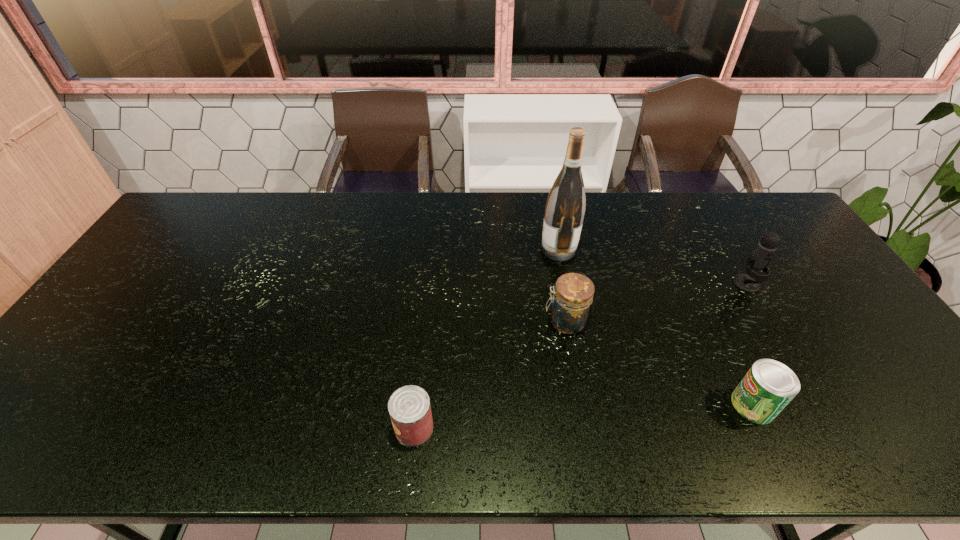
This screenshot has height=540, width=960. I want to click on free space at the right edge of the desktop, so click(x=813, y=321).

This screenshot has width=960, height=540. Identify the location of vacant position at the far right corner of the desktop. (757, 213).

This screenshot has height=540, width=960. Identify the location of blank area at the near right corner. (928, 456).

You are a GUI agent. You are given a task and a screenshot of the screen. Output one action in this format:
    pyautogui.click(x=<x>, y=<y>)
    Task: Click on the empty location between the left can and the farthest object
    The width and height of the screenshot is (960, 540).
    Given the screenshot: What is the action you would take?
    pyautogui.click(x=487, y=339)

Where is `empty location between the left can and the right can`? The image size is (960, 540). empty location between the left can and the right can is located at coordinates (584, 416).

Identify the location of free space between the leftmost object and the wine bottle. (487, 339).

Identify the location of empty space that is in between the left can and the fourth nearest object. (581, 356).

Identify the location of empty space between the fourth nearest object and the third shortest object. (656, 303).

Where is `free point between the left can and the rightmost object`? The image size is (960, 540). free point between the left can and the rightmost object is located at coordinates (581, 356).

Find the location of `vacant space that is in between the rightmost object and the tallest object`. vacant space that is in between the rightmost object and the tallest object is located at coordinates (653, 267).